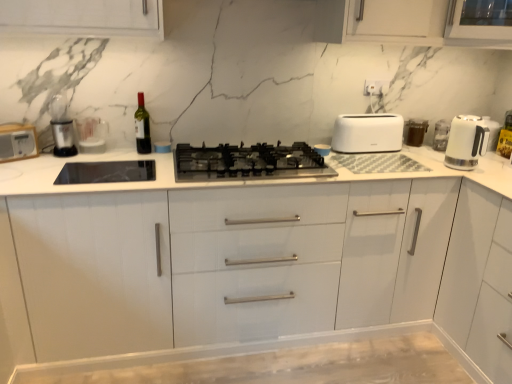
Question: Is white glossy electric kettle at right positioned before white plastic toaster at left?

Choices:
 (A) no
 (B) yes

Answer: (A)

Question: Can you confirm if white glossy electric kettle at right is taller than white plastic toaster at left?

Choices:
 (A) yes
 (B) no

Answer: (A)

Question: Would you say white plastic toaster at left is part of white glossy electric kettle at right's contents?

Choices:
 (A) no
 (B) yes

Answer: (A)

Question: From a real-world perspective, is white glossy electric kettle at right beneath white plastic toaster at left?

Choices:
 (A) yes
 (B) no

Answer: (B)

Question: Does white glossy electric kettle at right have a greater width compared to white plastic toaster at left?

Choices:
 (A) no
 (B) yes

Answer: (B)

Question: Is white glossy electric kettle at right outside white plastic toaster at left?

Choices:
 (A) no
 (B) yes

Answer: (B)

Question: Is white plastic toaster at left turned away from white matte toaster at right?

Choices:
 (A) no
 (B) yes

Answer: (A)

Question: Is white plastic toaster at left wider than white matte toaster at right?

Choices:
 (A) no
 (B) yes

Answer: (A)

Question: From the image's perspective, is white plastic toaster at left located beneath white matte toaster at right?

Choices:
 (A) yes
 (B) no

Answer: (A)

Question: Is white plastic toaster at left to the right of white matte toaster at right from the viewer's perspective?

Choices:
 (A) yes
 (B) no

Answer: (B)

Question: Is white plastic toaster at left positioned before white matte toaster at right?

Choices:
 (A) no
 (B) yes

Answer: (B)

Question: Considering the relative positions of white plastic toaster at left and white matte toaster at right in the image provided, is white plastic toaster at left to the left of white matte toaster at right from the viewer's perspective?

Choices:
 (A) yes
 (B) no

Answer: (A)

Question: Is the position of matte glass wine bottle at center less distant than that of white plastic toaster at left?

Choices:
 (A) yes
 (B) no

Answer: (B)